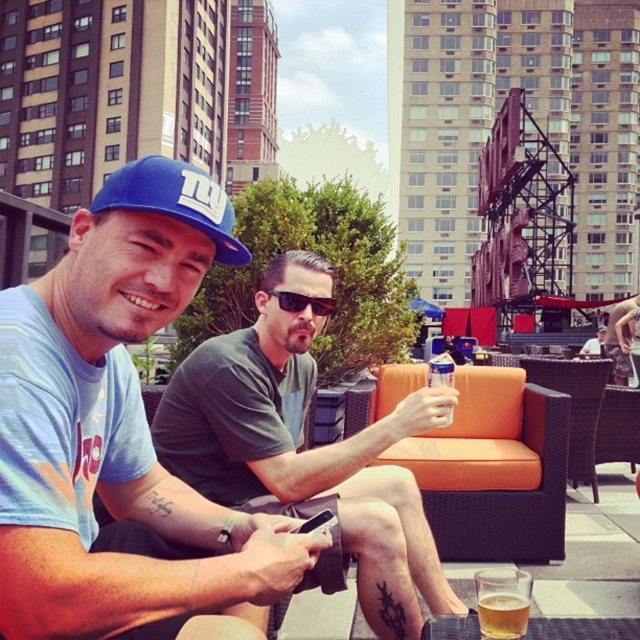
Question: Considering the relative positions of blue fabric cap at upper left and matte gray shirt at center in the image provided, where is blue fabric cap at upper left located with respect to matte gray shirt at center?

Choices:
 (A) left
 (B) right

Answer: (A)

Question: Which point is closer to the camera taking this photo?

Choices:
 (A) (444, 467)
 (B) (147, 275)

Answer: (B)

Question: Is blue fabric cap at upper left positioned in front of orange fabric couch at center?

Choices:
 (A) yes
 (B) no

Answer: (A)

Question: Does matte gray t-shirt at center have a greater width compared to blue fabric baseball cap at upper left?

Choices:
 (A) no
 (B) yes

Answer: (B)

Question: Which object is positioned farthest from the matte gray t-shirt at center?

Choices:
 (A) blue fabric cap at upper left
 (B) matte gray shirt at center
 (C) orange fabric couch at center

Answer: (B)

Question: Estimate the real-world distances between objects in this image. Which object is closer to the blue fabric cap at upper left?

Choices:
 (A) matte gray t-shirt at center
 (B) black plastic sunglasses at center
 (C) matte gray shirt at center
 (D) blue fabric baseball cap at upper left

Answer: (D)